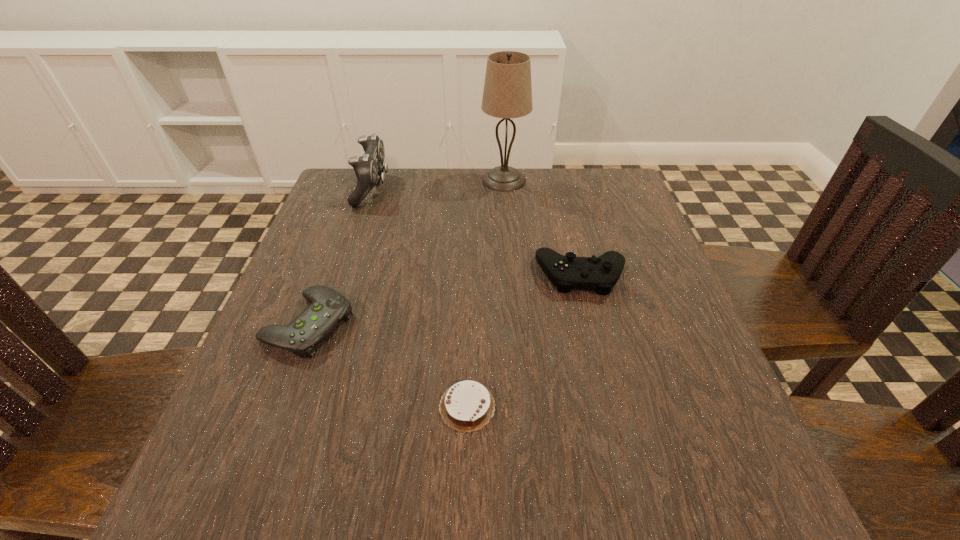
What are the coordinates of `free spot that satisfies the following two spatial constraints: 1. on the front-facing side of the lampshade; 2. on the front side of the second shortest object` in the screenshot? It's located at (515, 324).

This screenshot has width=960, height=540. Identify the location of free location that satisfies the following two spatial constraints: 1. on the front-facing side of the lampshade; 2. on the front side of the shortest control. (515, 324).

Where is `free space that satisfies the following two spatial constraints: 1. on the surface of the tallest control with buttons; 2. on the right side of the nearest object`? This screenshot has width=960, height=540. free space that satisfies the following two spatial constraints: 1. on the surface of the tallest control with buttons; 2. on the right side of the nearest object is located at coordinates (301, 406).